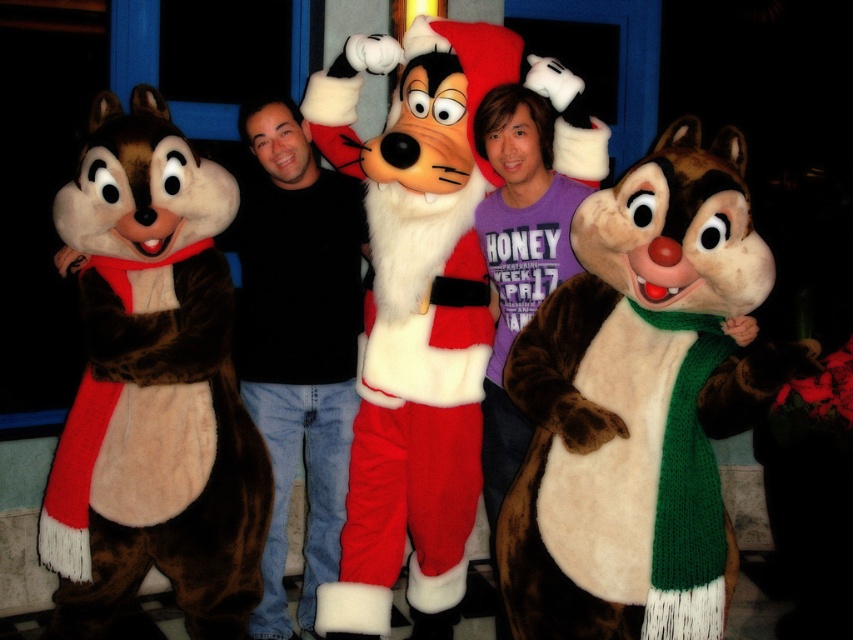
You are organizing a photo shoot and need to ensure the brown furry chipmunk at center and the black cotton shirt at center fit within a rectangular frame. Which object requires a wider frame to accommodate its width?

The brown furry chipmunk at center requires a wider frame because its width surpasses that of the black cotton shirt at center.

You are standing in front of the scene and want to touch the brown furry chipmunk at left and the black cotton shirt at center. Which object is closer to your hand?

The brown furry chipmunk at left is closer to the viewer than the black cotton shirt at center, so you can reach the brown furry chipmunk at left first.

You are a photographer standing at a certain distance from the brown furry chipmunk at center. You want to take a photo that requires you to be exactly 6 feet away. Is your current position suitable?

The distance between you and the brown furry chipmunk at center is 6.70 feet, which is slightly more than 6 feet. Therefore, you need to move closer by 0.70 feet to achieve the desired distance.